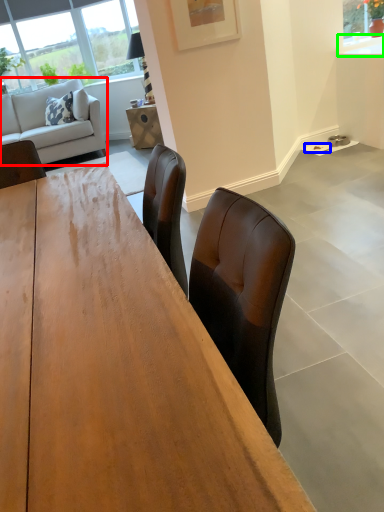
Question: Estimate the real-world distances between objects in this image. Which object is closer to studio couch (highlighted by a red box), plate (highlighted by a blue box) or counter top (highlighted by a green box)?

Choices:
 (A) plate
 (B) counter top

Answer: (A)